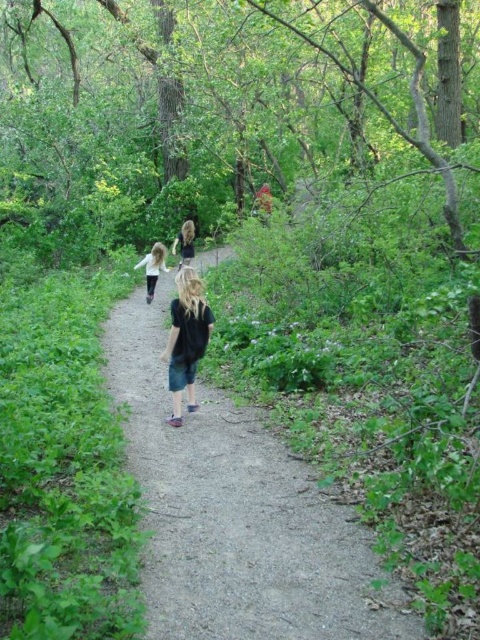
You are a photographer trying to capture a photo of the denim shorts at center and the blonde hair at center. Based on their heights, which object should you focus on first if you want to ensure both are in the frame without adjusting your camera angle?

The denim shorts at center has a lesser height compared to blonde hair at center, so you should focus on the denim shorts at center first to ensure both are in the frame.

You are standing on the forest path and see the white cotton shirt at center and the blonde hair at center. How far apart are these two features?

The white cotton shirt at center is 3.74 meters from the blonde hair at center.

You are a photographer trying to capture a photo of the denim shorts at center and the white cotton shirt at center. Since you want to ensure both are clearly visible in the frame, which object should you focus on to account for their sizes?

You should focus on the denim shorts at center because it has a larger size compared to the white cotton shirt at center, making it more prominent in the photo.